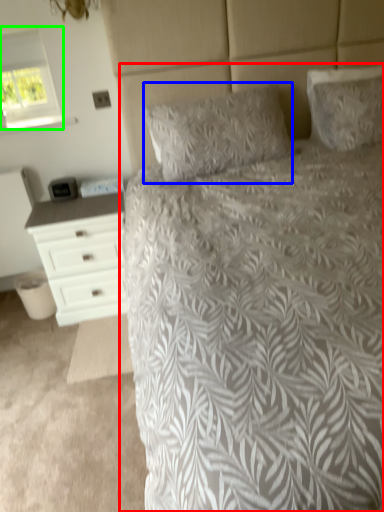
Question: Based on their relative distances, which object is nearer to bed (highlighted by a red box)? Choose from pillow (highlighted by a blue box) and window (highlighted by a green box).

Choices:
 (A) pillow
 (B) window

Answer: (A)